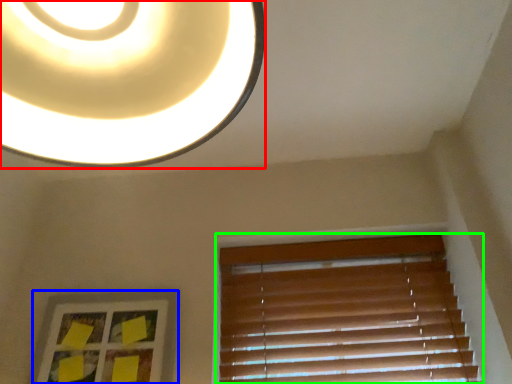
Question: Which object is positioned farthest from lamp (highlighted by a red box)? Select from picture frame (highlighted by a blue box) and window blind (highlighted by a green box).

Choices:
 (A) picture frame
 (B) window blind

Answer: (B)